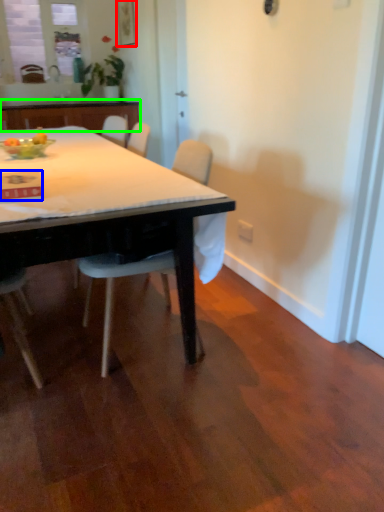
Question: Based on their relative distances, which object is nearer to picture frame (highlighted by a red box)? Choose from kitchen & dining room table (highlighted by a blue box) and cabinetry (highlighted by a green box).

Choices:
 (A) kitchen & dining room table
 (B) cabinetry

Answer: (B)